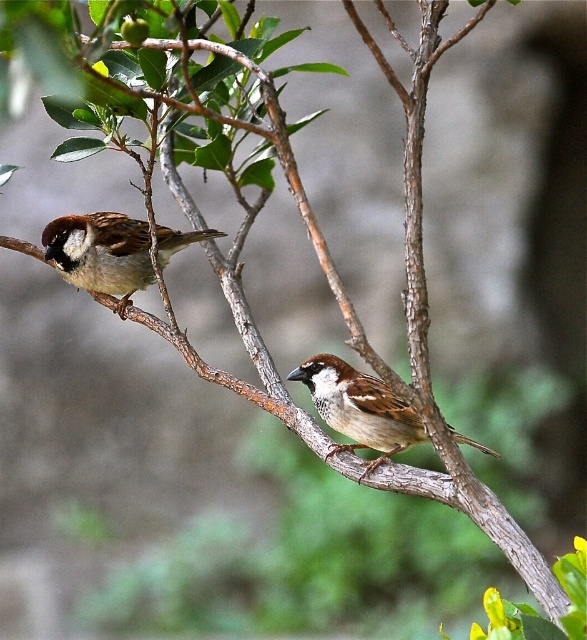
Question: Is brown matte sparrow at left to the left of brown feathered sparrow at center from the viewer's perspective?

Choices:
 (A) no
 (B) yes

Answer: (B)

Question: Can you confirm if brown matte sparrow at left is smaller than brown feathered sparrow at center?

Choices:
 (A) no
 (B) yes

Answer: (A)

Question: Is brown matte sparrow at left smaller than brown feathered sparrow at center?

Choices:
 (A) yes
 (B) no

Answer: (B)

Question: Which of the following is the farthest from the observer?

Choices:
 (A) (102, 257)
 (B) (365, 401)

Answer: (A)

Question: Among these objects, which one is farthest from the camera?

Choices:
 (A) brown feathered sparrow at center
 (B) brown matte sparrow at left

Answer: (B)